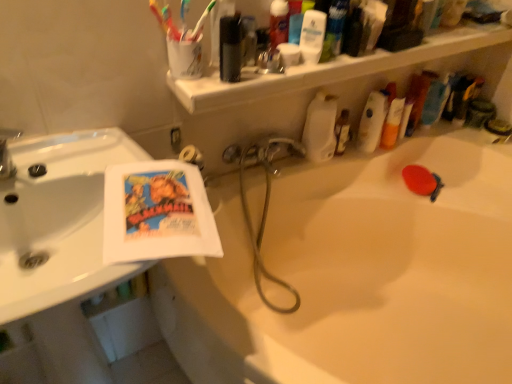
Question: Is white matte bottle at upper center, which is counted as the 1th cleaning product, starting from the left, in front of or behind white glossy mouthwash at upper center, which appears as the first mouthwash when viewed from the right, in the image?

Choices:
 (A) behind
 (B) front

Answer: (A)

Question: Is white matte bottle at upper center, the 2th cleaning product from the right, bigger or smaller than white glossy mouthwash at upper center, which appears as the first mouthwash when viewed from the right?

Choices:
 (A) small
 (B) big

Answer: (B)

Question: Estimate the real-world distances between objects in this image. Which object is farther from the white plastic toothbrush at upper center, the second toothbrush viewed from the left?

Choices:
 (A) translucent plastic toothbrush at upper left, the first toothbrush in the left-to-right sequence
 (B) white plastic shelf at upper center
 (C) translucent plastic bottle at upper right, positioned as the 1th cleaning product in right-to-left order
 (D) metallic silver mouthwash at upper center, the first mouthwash in the left-to-right sequence
 (E) metallic silver soap dispenser at upper right, which is counted as the 2th toiletry, starting from the left

Answer: (E)

Question: Which object is positioned closest to the metallic silver mouthwash at upper center, the first mouthwash in the left-to-right sequence?

Choices:
 (A) white plastic shelf at upper center
 (B) translucent plastic bottle at upper right, positioned as the 1th cleaning product in right-to-left order
 (C) metallic silver soap dispenser at upper right, the 1th toiletry from the right
 (D) white matte bottle at upper center, which is counted as the 1th cleaning product, starting from the left
 (E) white glossy mouthwash at upper center, which appears as the first mouthwash when viewed from the right

Answer: (E)